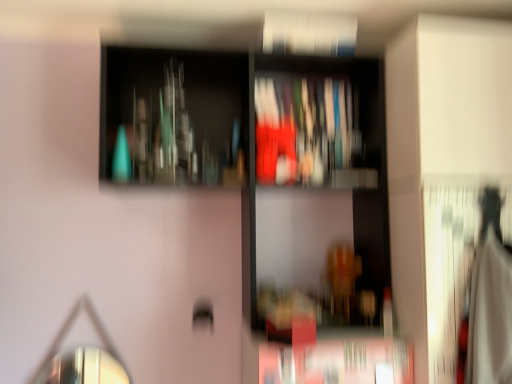
Question: Is matte plastic book at center, acting as the first book starting from the bottom, surrounding shiny metallic mirror at lower left?

Choices:
 (A) no
 (B) yes

Answer: (A)

Question: Can you confirm if matte plastic book at center, which is the second book from top to bottom, is thinner than shiny metallic mirror at lower left?

Choices:
 (A) yes
 (B) no

Answer: (B)

Question: Does matte plastic book at center, acting as the first book starting from the bottom, lie behind shiny metallic mirror at lower left?

Choices:
 (A) no
 (B) yes

Answer: (B)

Question: Considering the relative sizes of matte plastic book at center, the 1th book in the back-to-front sequence, and shiny metallic mirror at lower left in the image provided, is matte plastic book at center, the 1th book in the back-to-front sequence, taller than shiny metallic mirror at lower left?

Choices:
 (A) no
 (B) yes

Answer: (A)

Question: Is matte plastic book at center, the 2th book in the front-to-back sequence, facing towards shiny metallic mirror at lower left?

Choices:
 (A) no
 (B) yes

Answer: (A)

Question: Considering the relative positions of shiny metallic mirror at lower left and white paper book at upper center, acting as the first book starting from the front, in the image provided, is shiny metallic mirror at lower left to the left or to the right of white paper book at upper center, acting as the first book starting from the front,?

Choices:
 (A) right
 (B) left

Answer: (B)

Question: From a real-world perspective, relative to white paper book at upper center, the 2th book positioned from the bottom, is shiny metallic mirror at lower left vertically above or below?

Choices:
 (A) below
 (B) above

Answer: (A)

Question: Is shiny metallic mirror at lower left inside the boundaries of white paper book at upper center, the 2th book positioned from the bottom, or outside?

Choices:
 (A) inside
 (B) outside

Answer: (B)

Question: Is shiny metallic mirror at lower left taller or shorter than white paper book at upper center, the 1th book positioned from the top?

Choices:
 (A) short
 (B) tall

Answer: (B)

Question: Choose the correct answer: Is matte plastic book at center, the 2th book in the front-to-back sequence, inside matte glass bottles at upper center or outside it?

Choices:
 (A) inside
 (B) outside

Answer: (A)

Question: Based on their sizes in the image, would you say matte plastic book at center, acting as the first book starting from the bottom, is bigger or smaller than matte glass bottles at upper center?

Choices:
 (A) small
 (B) big

Answer: (A)

Question: Based on their positions, is matte plastic book at center, the 2th book in the front-to-back sequence, located to the left or right of matte glass bottles at upper center?

Choices:
 (A) right
 (B) left

Answer: (A)

Question: Is point (278, 172) closer or farther from the camera than point (254, 297)?

Choices:
 (A) farther
 (B) closer

Answer: (A)

Question: Considering their positions, is white paper book at upper center, the second book viewed from the back, located in front of or behind matte glass bottles at upper center?

Choices:
 (A) front
 (B) behind

Answer: (B)

Question: From a real-world perspective, is white paper book at upper center, the 1th book positioned from the top, physically located above or below matte glass bottles at upper center?

Choices:
 (A) above
 (B) below

Answer: (A)